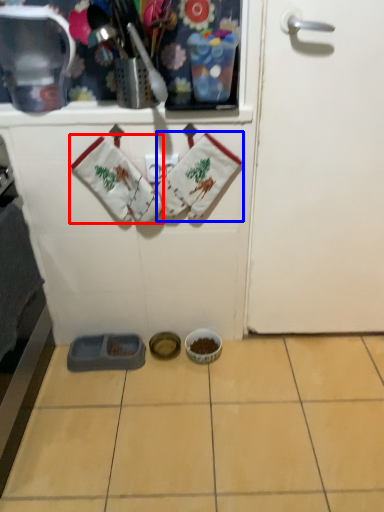
Question: Which of the following is the closest to the observer, baby clothe (highlighted by a red box) or baby clothe (highlighted by a blue box)?

Choices:
 (A) baby clothe
 (B) baby clothe

Answer: (A)